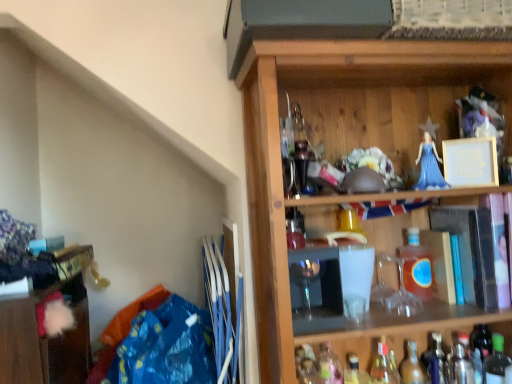
Question: Considering the relative sizes of wooden cabinet at lower left and translucent glass bottle at lower center, the first bottle positioned from the left, in the image provided, is wooden cabinet at lower left bigger than translucent glass bottle at lower center, the first bottle positioned from the left,?

Choices:
 (A) yes
 (B) no

Answer: (A)

Question: Is wooden cabinet at lower left looking in the opposite direction of translucent glass bottle at lower center, acting as the eighth bottle starting from the right?

Choices:
 (A) no
 (B) yes

Answer: (A)

Question: Can you confirm if wooden cabinet at lower left is positioned to the right of translucent glass bottle at lower center, acting as the eighth bottle starting from the right?

Choices:
 (A) no
 (B) yes

Answer: (A)

Question: Is wooden cabinet at lower left thinner than translucent glass bottle at lower center, the first bottle positioned from the left?

Choices:
 (A) no
 (B) yes

Answer: (A)

Question: Is wooden cabinet at lower left outside of translucent glass bottle at lower center, acting as the eighth bottle starting from the right?

Choices:
 (A) no
 (B) yes

Answer: (B)

Question: Are wooden cabinet at lower left and translucent glass bottle at lower center, the first bottle positioned from the left, located far from each other?

Choices:
 (A) no
 (B) yes

Answer: (A)

Question: Can you confirm if metallic silver shaker at lower right, the 7th bottle from the left, is shorter than wooden cabinet at lower left?

Choices:
 (A) yes
 (B) no

Answer: (A)

Question: Does metallic silver shaker at lower right, the 7th bottle from the left, have a lesser width compared to wooden cabinet at lower left?

Choices:
 (A) yes
 (B) no

Answer: (A)

Question: From a real-world perspective, is metallic silver shaker at lower right, which appears as the second bottle when viewed from the right, below wooden cabinet at lower left?

Choices:
 (A) no
 (B) yes

Answer: (B)

Question: Is metallic silver shaker at lower right, the 7th bottle from the left, at the left side of wooden cabinet at lower left?

Choices:
 (A) no
 (B) yes

Answer: (A)

Question: From the image's perspective, does metallic silver shaker at lower right, which appears as the second bottle when viewed from the right, appear higher than wooden cabinet at lower left?

Choices:
 (A) no
 (B) yes

Answer: (A)

Question: Does metallic silver shaker at lower right, the 7th bottle from the left, appear on the right side of wooden cabinet at lower left?

Choices:
 (A) yes
 (B) no

Answer: (A)

Question: Considering the relative positions of translucent glass bottle at lower right, marked as the sixth bottle in a right-to-left arrangement, and translucent amber glass bottle at center-right, which is counted as the fifth bottle, starting from the right, in the image provided, is translucent glass bottle at lower right, marked as the sixth bottle in a right-to-left arrangement, to the right of translucent amber glass bottle at center-right, which is counted as the fifth bottle, starting from the right, from the viewer's perspective?

Choices:
 (A) no
 (B) yes

Answer: (A)